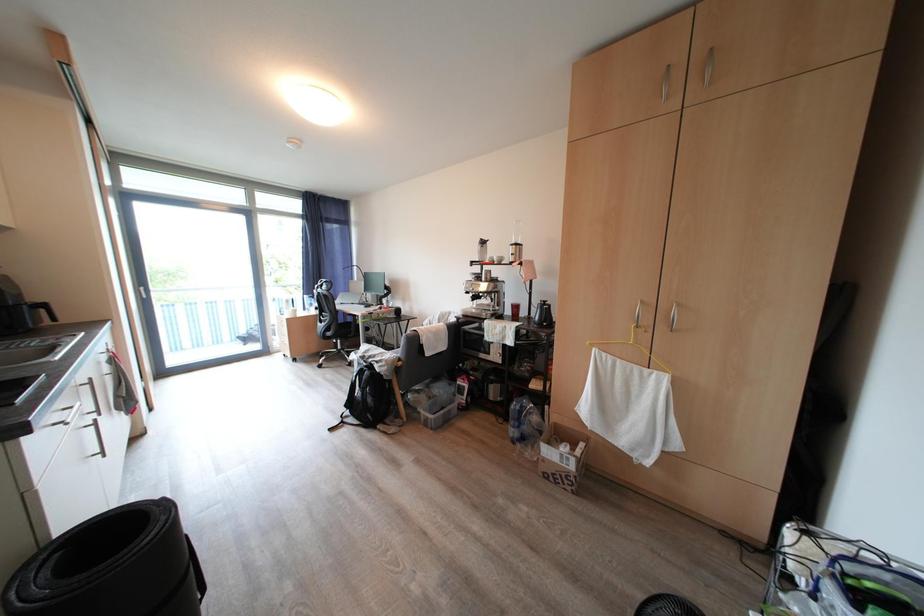
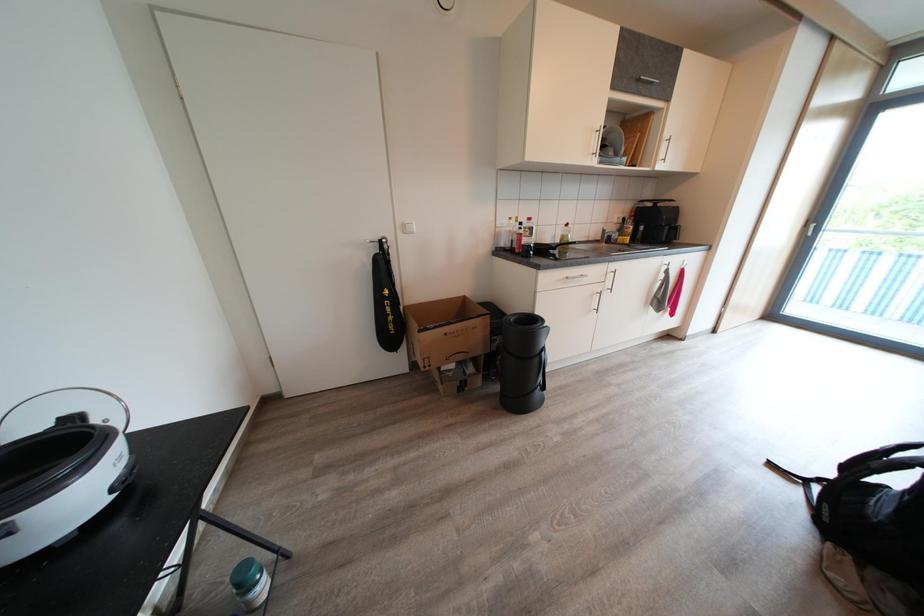
First-person continuous shooting, in which direction is the camera rotating?

The camera rotated toward left-down.